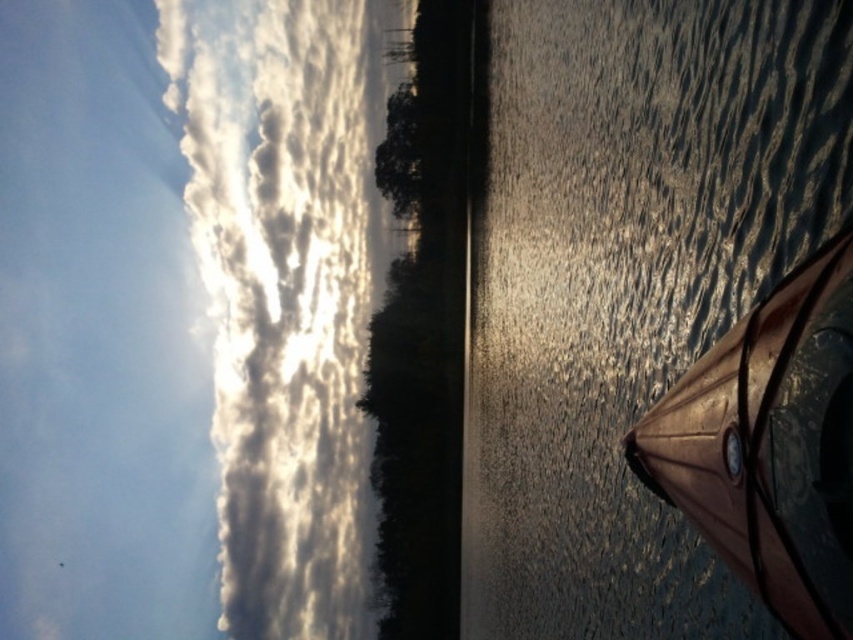
Image resolution: width=853 pixels, height=640 pixels. Describe the element at coordinates (625, 284) in the screenshot. I see `glistening water at lower right` at that location.

From the picture: Does glistening water at lower right appear on the right side of cloudy sky at upper left?

Yes, glistening water at lower right is to the right of cloudy sky at upper left.

Does point (631, 364) come farther from viewer compared to point (228, 77)?

No, it is not.

The height and width of the screenshot is (640, 853). I want to click on glistening water at lower right, so 625,284.